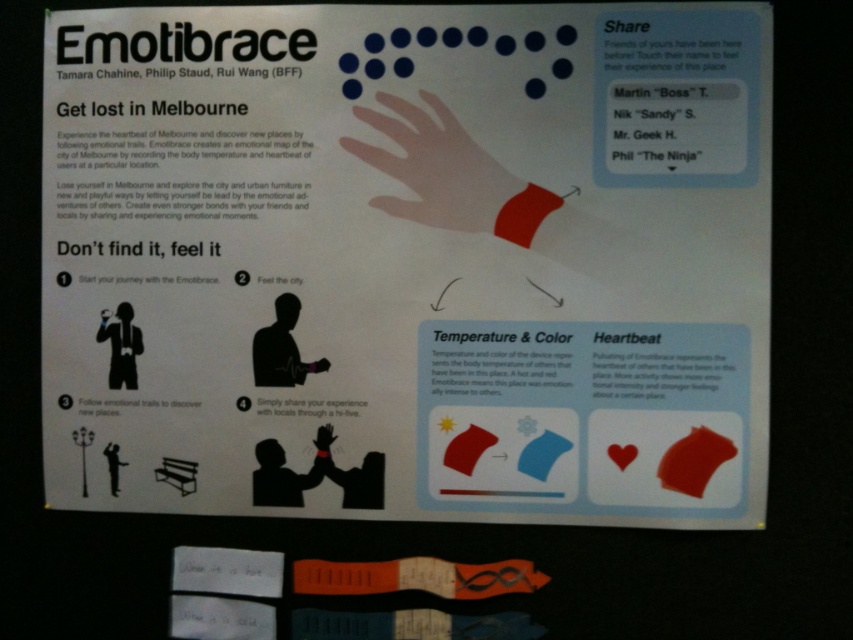
You are standing in front of the promotional materials for the Emotibrace project. Where exactly is the white paper poster at upper center located?

The white paper poster at upper center is located at point (408, 260).

You are standing in front of the Emotibrace poster and notice both the white paper poster at upper center and the white matte hand at center. Which object is nearer to you?

The white paper poster at upper center is closer to the viewer than the white matte hand at center.

You are a passerby looking at the white paper poster at upper center and the white matte hand at center on the wall. Which object is located to the left?

The white paper poster at upper center is positioned on the left side of the white matte hand at center.